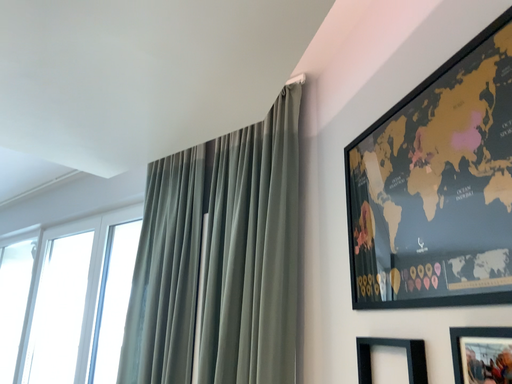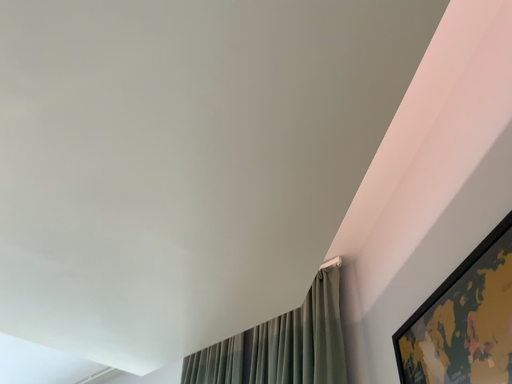
Question: Which way did the camera rotate in the video?

Choices:
 (A) rotated downward
 (B) rotated upward

Answer: (B)